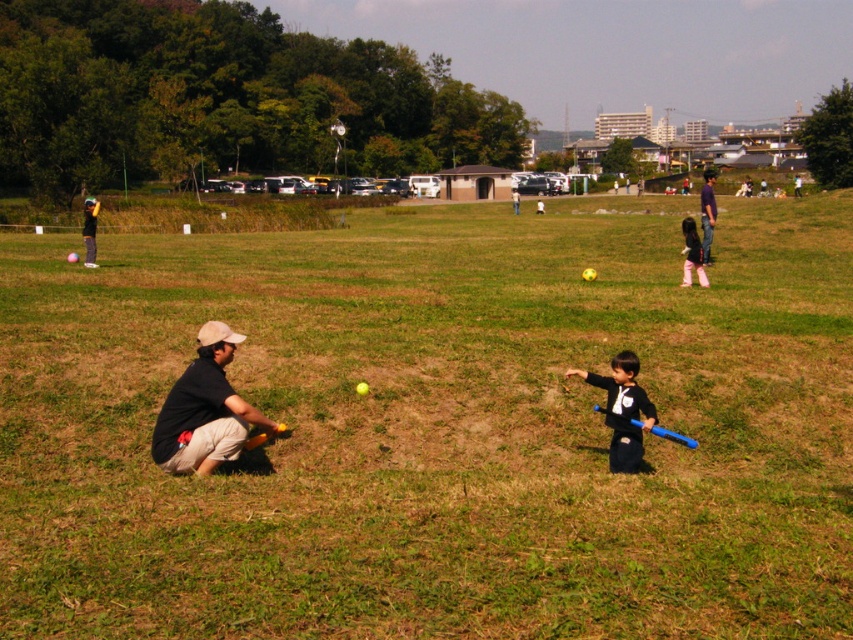
You are a photographer standing at the camera position. You want to take a photo that includes both the point at coordinates point (380, 632) and point (608, 412). Which point should you focus on first to ensure both are in focus?

You should focus on point (380, 632) first because it is closer to the camera than point (608, 412). By focusing on the closer point, the farther point will also be within the depth of field and in focus.

Based on the photo, you are a park visitor who wants to pick up both the blue plastic bat at lower center and the yellow matte baseball bat at lower center. Can you reach both bats without moving your feet?

The distance between the blue plastic bat at lower center and the yellow matte baseball bat at lower center is 2.67 meters. Since this distance is greater than the average person can reach without moving their feet, you cannot reach both bats simultaneously without moving.

You are a coach observing the two bats in the park. Which bat is closer to you, the blue plastic bat at lower center or the yellow matte baseball bat at lower center?

The blue plastic bat at lower center is closer to you because the yellow matte baseball bat at lower center is behind it.